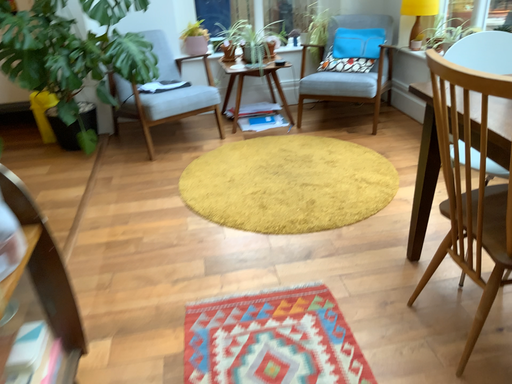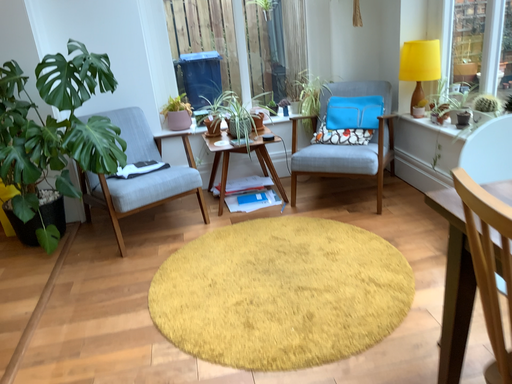
Question: How did the camera likely rotate when shooting the video?

Choices:
 (A) rotated downward
 (B) rotated upward

Answer: (B)